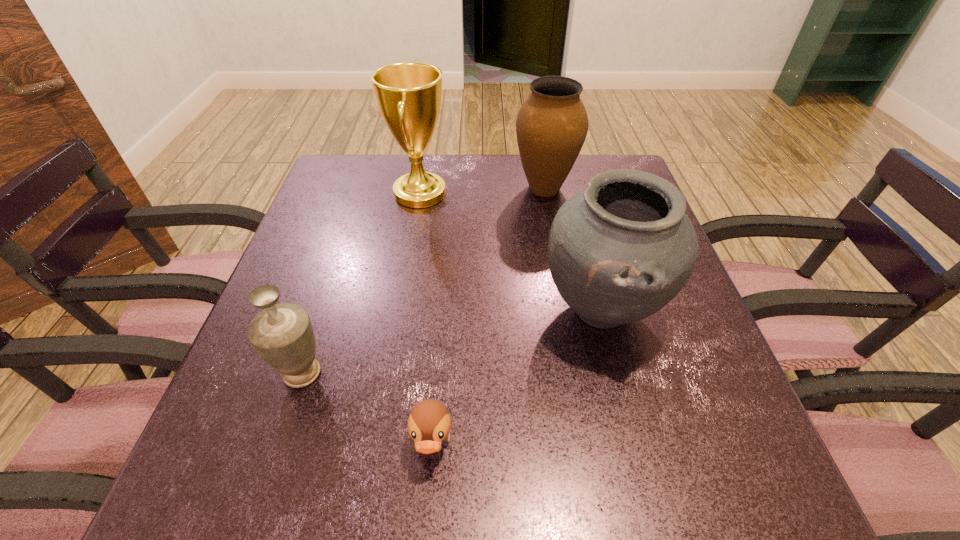
This screenshot has height=540, width=960. Identify the location of empty space between the farthest urn and the leftmost urn. [x=423, y=281].

Where is `free space between the farthest urn and the leftmost object`? Image resolution: width=960 pixels, height=540 pixels. free space between the farthest urn and the leftmost object is located at coordinates (423, 281).

At what (x,y) coordinates should I click in order to perform the action: click on vacant area that lies between the shortest urn and the nearest object. Please return your answer as a coordinate pair (x, y). This screenshot has height=540, width=960. Looking at the image, I should click on (368, 410).

Locate an element on the screen. object that is the closest one to the leftmost object is located at coordinates (429, 423).

I want to click on object identified as the third closest to the award, so click(282, 334).

At what (x,y) coordinates should I click in order to perform the action: click on the second closest urn to the shortest urn. Please return your answer as a coordinate pair (x, y). Looking at the image, I should click on (552, 124).

Locate an element on the screen. the second closest urn to the award is located at coordinates (620, 250).